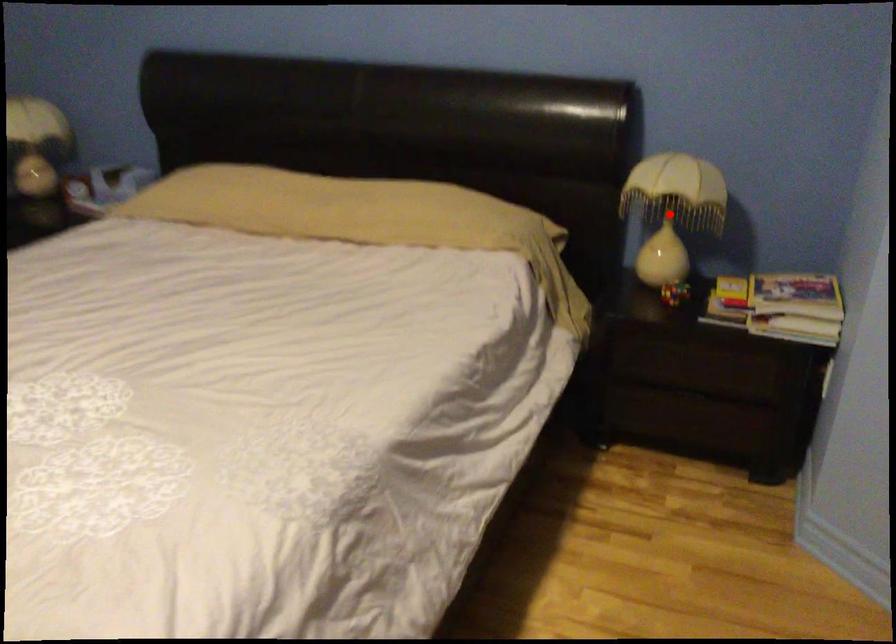
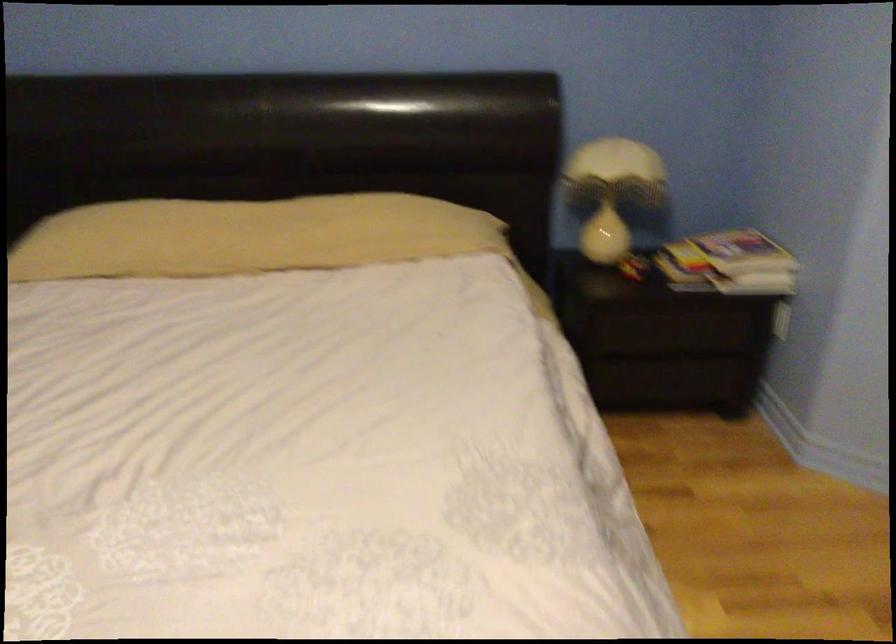
In the second image, find the point that corresponds to the highlighted location in the first image.

(613, 191)